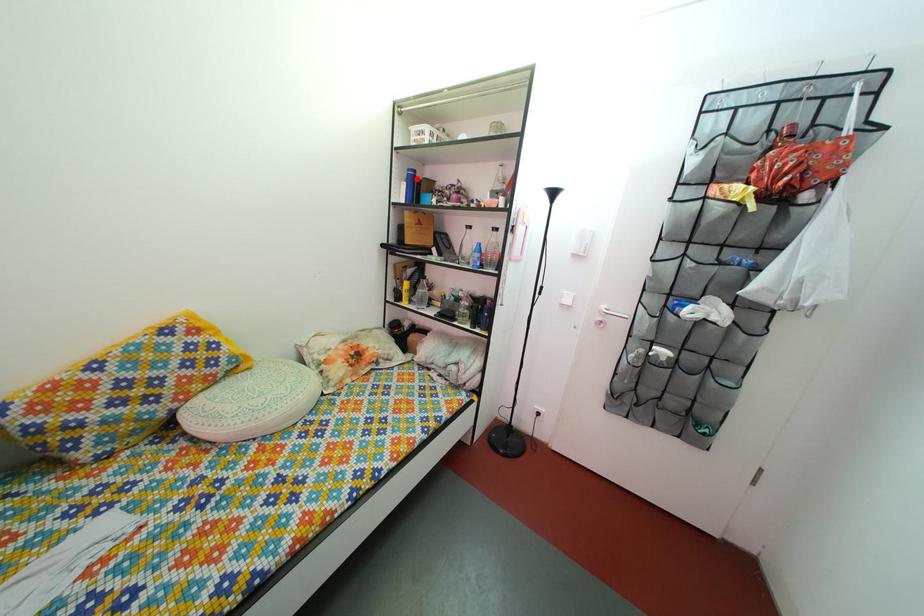
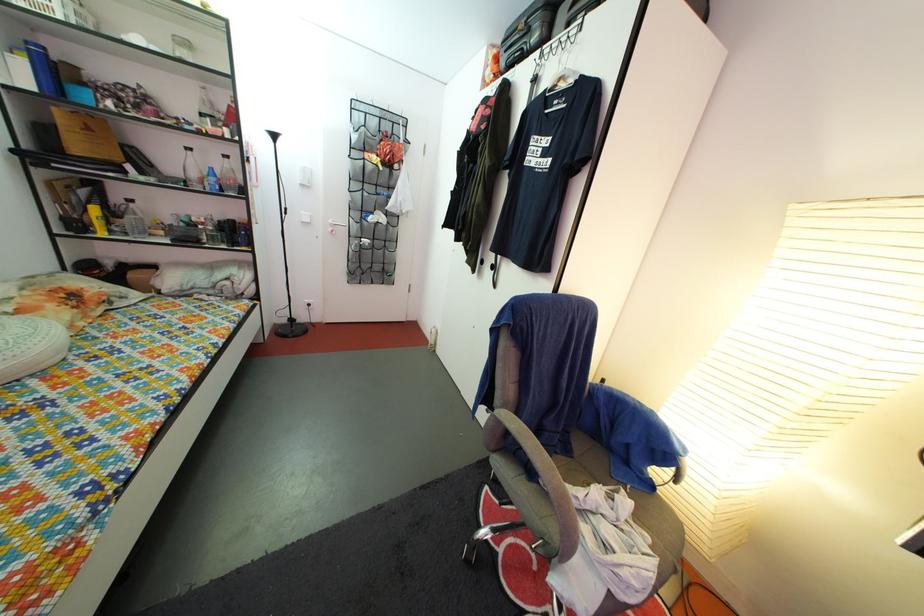
Question: I am providing you with two images of the same scene from different viewpoints. In image1, a red point is highlighted. Considering the same 3D point in image2, which of the following is correct?

Choices:
 (A) It is closer
 (B) It is farther

Answer: (B)